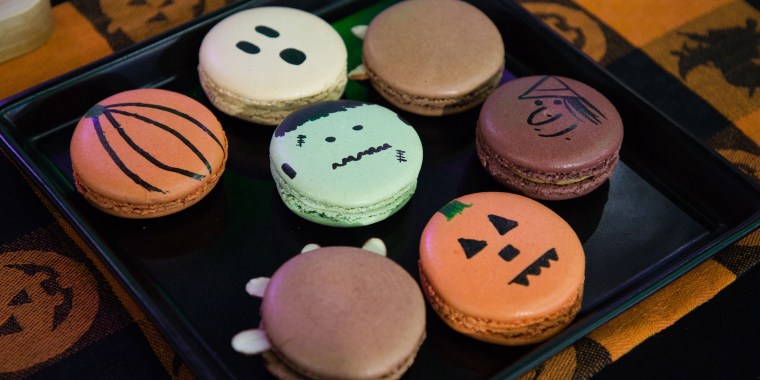
This screenshot has width=760, height=380. What are the coordinates of `tray` in the screenshot? It's located at (622, 217).